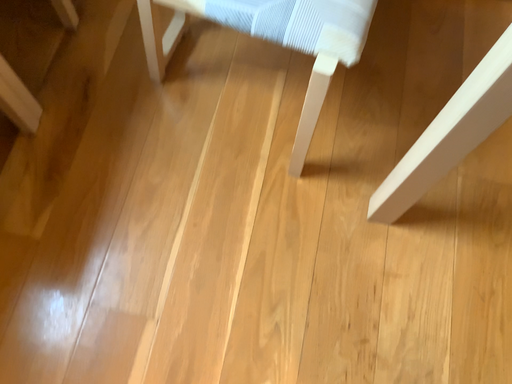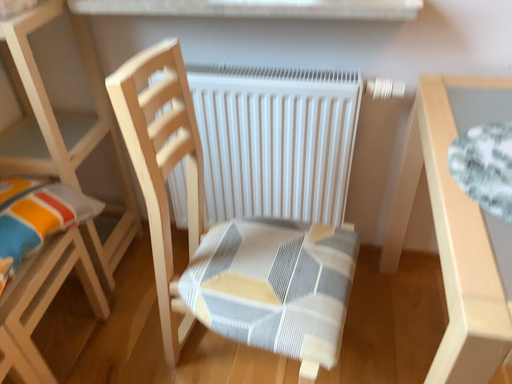
Question: Which way did the camera rotate in the video?

Choices:
 (A) rotated upward
 (B) rotated downward

Answer: (A)